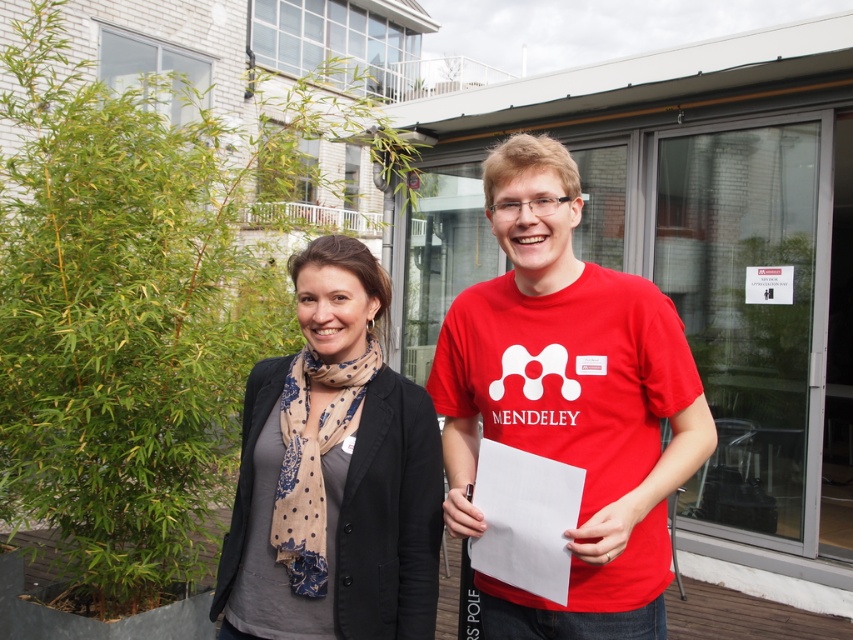
Question: From the image, what is the correct spatial relationship of red matte t-shirt at center in relation to matte black blazer at center?

Choices:
 (A) below
 (B) above

Answer: (B)

Question: Can you confirm if red matte t-shirt at center is bigger than matte black blazer at center?

Choices:
 (A) yes
 (B) no

Answer: (A)

Question: Which of the following is the closest to the observer?

Choices:
 (A) matte black blazer at center
 (B) red matte t-shirt at center

Answer: (B)

Question: Which point is closer to the camera?

Choices:
 (A) click(x=577, y=596)
 (B) click(x=355, y=573)

Answer: (A)

Question: Which point is farther to the camera?

Choices:
 (A) (482, 372)
 (B) (334, 449)

Answer: (A)

Question: Does red matte t-shirt at center appear over matte black blazer at center?

Choices:
 (A) yes
 (B) no

Answer: (A)